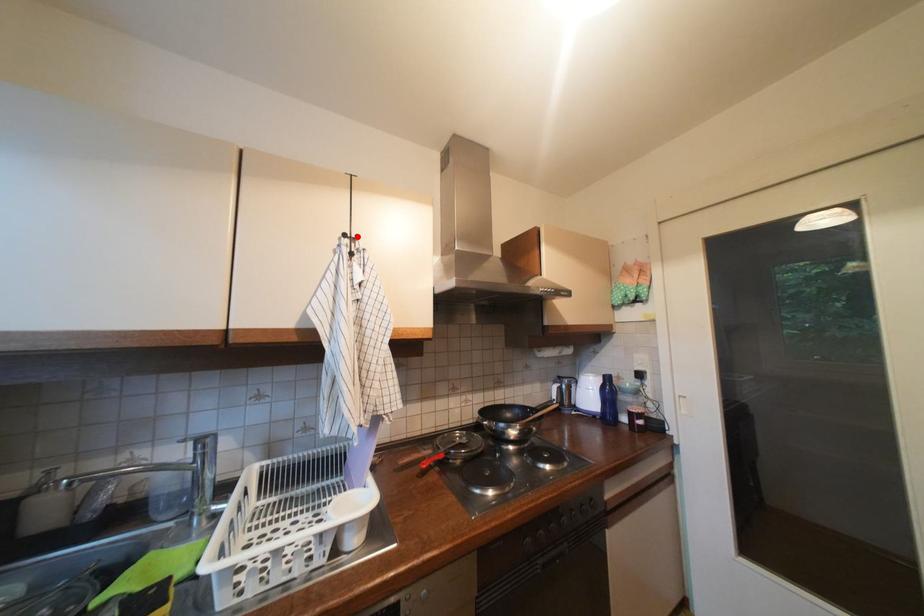
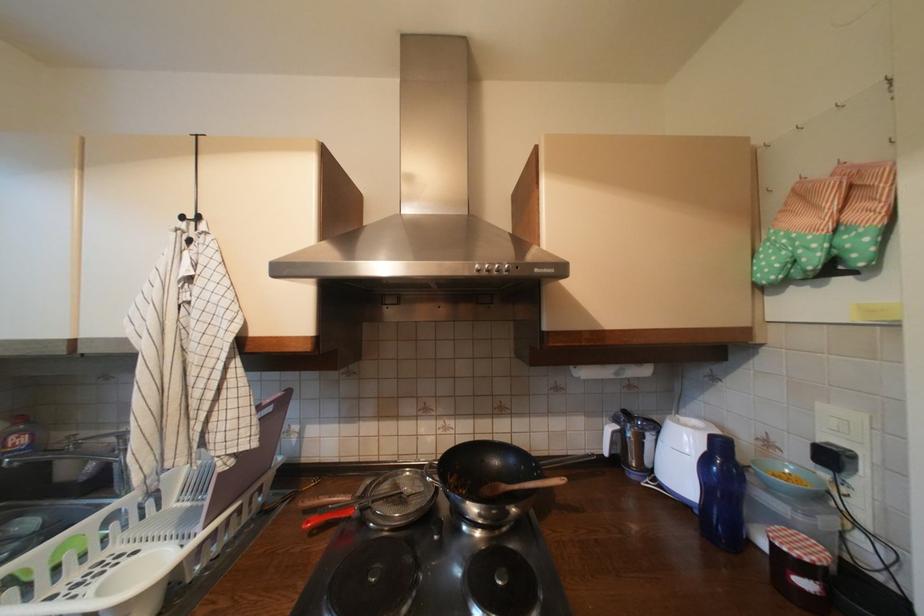
Locate, in the second image, the point that corresponds to the highlighted location in the first image.

(197, 219)